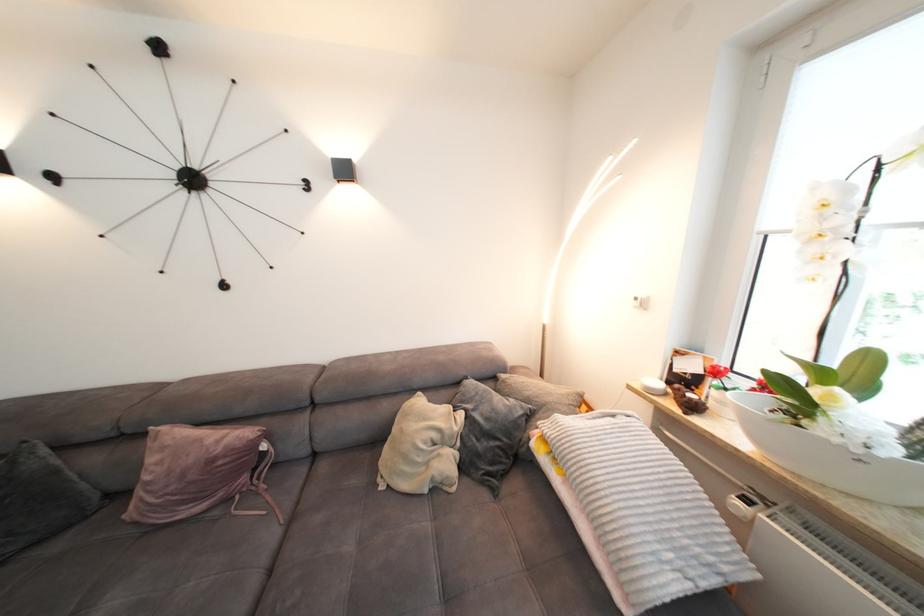
Image resolution: width=924 pixels, height=616 pixels. What do you see at coordinates (356, 548) in the screenshot? I see `the sofa sitting surface` at bounding box center [356, 548].